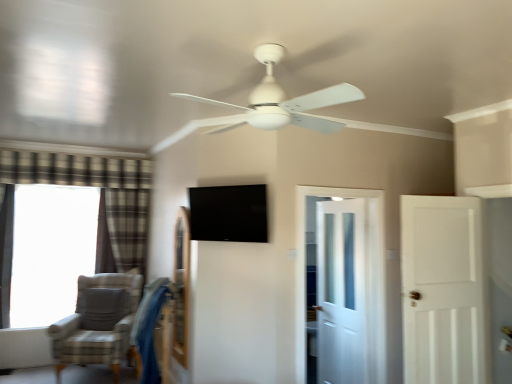
Question: Could white matte door at right, which appears as the 1th door when viewed from the front, be considered to be inside gray fabric chair at lower left?

Choices:
 (A) no
 (B) yes

Answer: (A)

Question: From the image's perspective, is gray fabric chair at lower left above white matte door at right, the 2th door viewed from the back?

Choices:
 (A) yes
 (B) no

Answer: (B)

Question: Does gray fabric chair at lower left have a greater width compared to white matte door at right, the first door when ordered from right to left?

Choices:
 (A) no
 (B) yes

Answer: (B)

Question: From a real-world perspective, is gray fabric chair at lower left beneath white matte door at right, the first door when ordered from right to left?

Choices:
 (A) no
 (B) yes

Answer: (B)

Question: Would you say gray fabric chair at lower left is outside white matte door at right, which appears as the 1th door when viewed from the front?

Choices:
 (A) no
 (B) yes

Answer: (B)

Question: Is black glossy tv at center taller or shorter than white glossy door at center, the first door when ordered from back to front?

Choices:
 (A) tall
 (B) short

Answer: (B)

Question: Based on their positions, is black glossy tv at center located to the left or right of white glossy door at center, which ranks as the first door in left-to-right order?

Choices:
 (A) left
 (B) right

Answer: (A)

Question: Considering the positions of black glossy tv at center and white glossy door at center, which ranks as the first door in left-to-right order, in the image, is black glossy tv at center wider or thinner than white glossy door at center, which ranks as the first door in left-to-right order,?

Choices:
 (A) wide
 (B) thin

Answer: (B)

Question: Is black glossy tv at center inside or outside of white glossy door at center, acting as the 2th door starting from the right?

Choices:
 (A) outside
 (B) inside

Answer: (A)

Question: From a real-world perspective, relative to blue fabric swivel chair at lower left, is white glossy door at center, the first door when ordered from back to front, vertically above or below?

Choices:
 (A) below
 (B) above

Answer: (B)

Question: Looking at the image, does white glossy door at center, acting as the 2th door starting from the right, seem bigger or smaller compared to blue fabric swivel chair at lower left?

Choices:
 (A) big
 (B) small

Answer: (B)

Question: From their relative heights in the image, would you say white glossy door at center, acting as the 2th door starting from the front, is taller or shorter than blue fabric swivel chair at lower left?

Choices:
 (A) short
 (B) tall

Answer: (B)

Question: Does point (330, 253) appear closer or farther from the camera than point (139, 322)?

Choices:
 (A) farther
 (B) closer

Answer: (A)

Question: From a real-world perspective, relative to black glossy tv at center, is white glossy door at center, acting as the 2th door starting from the right, vertically above or below?

Choices:
 (A) below
 (B) above

Answer: (A)

Question: In terms of height, does white glossy door at center, acting as the 2th door starting from the right, look taller or shorter compared to black glossy tv at center?

Choices:
 (A) tall
 (B) short

Answer: (A)